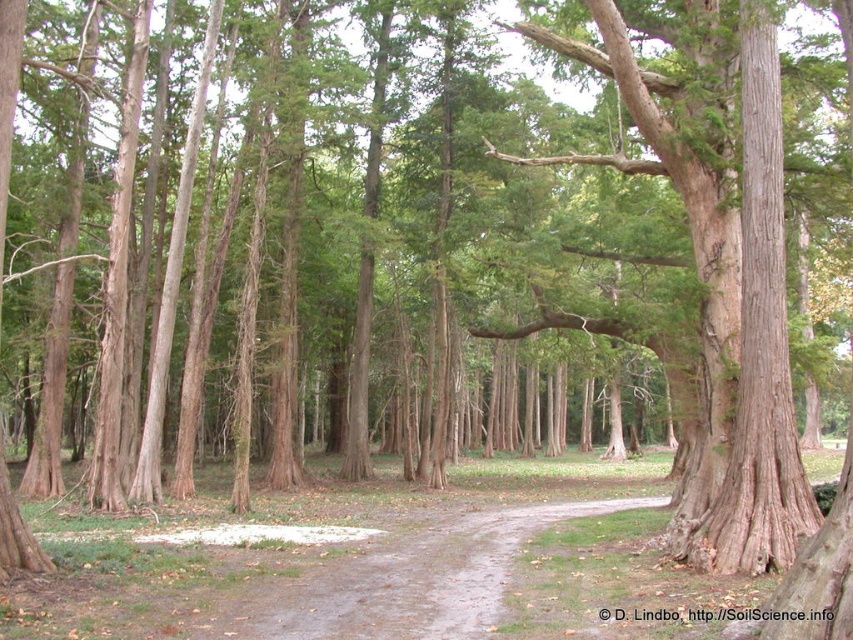
Can you confirm if brown rough textured tree at center is shorter than brown dirt path at center?

In fact, brown rough textured tree at center may be taller than brown dirt path at center.

Describe the element at coordinates (706, 298) in the screenshot. I see `brown rough textured tree at center` at that location.

You are a GUI agent. You are given a task and a screenshot of the screen. Output one action in this format:
    pyautogui.click(x=<x>, y=<y>)
    Task: Click on the brown rough textured tree at center
    The height and width of the screenshot is (640, 853).
    Given the screenshot: What is the action you would take?
    pyautogui.click(x=706, y=298)

Locate an element on the screen. brown rough textured tree at center is located at coordinates (706, 298).